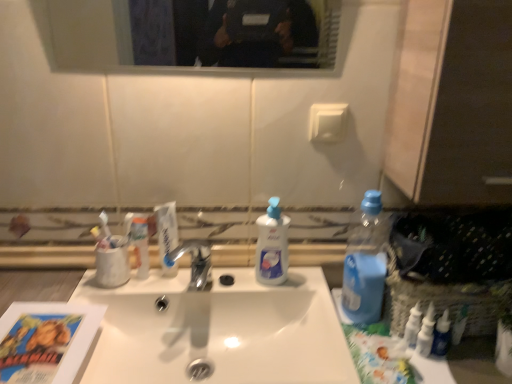
Question: Is white glossy sink at center bigger than white plastic bottles at right, the second toiletry in the left-to-right sequence?

Choices:
 (A) yes
 (B) no

Answer: (A)

Question: Does white glossy sink at center touch white plastic bottles at right, the 2th toiletry in the back-to-front sequence?

Choices:
 (A) no
 (B) yes

Answer: (A)

Question: From the image's perspective, is white glossy sink at center located above white plastic bottles at right, positioned as the 2th toiletry in right-to-left order?

Choices:
 (A) no
 (B) yes

Answer: (A)

Question: Does white glossy sink at center have a smaller size compared to white plastic bottles at right, the 2th toiletry in the back-to-front sequence?

Choices:
 (A) no
 (B) yes

Answer: (A)

Question: Is white plastic bottles at right, the 2th toiletry in the back-to-front sequence, completely or partially inside white glossy sink at center?

Choices:
 (A) yes
 (B) no

Answer: (B)

Question: Considering the relative positions of white glossy sink at center and white plastic bottles at right, which is the 2th toiletry in front-to-back order, in the image provided, is white glossy sink at center to the right of white plastic bottles at right, which is the 2th toiletry in front-to-back order, from the viewer's perspective?

Choices:
 (A) no
 (B) yes

Answer: (A)

Question: Can you see blue plastic bottle at right touching white plastic bottles at right, the second toiletry in the left-to-right sequence?

Choices:
 (A) yes
 (B) no

Answer: (B)

Question: Is the position of blue plastic bottle at right more distant than that of white plastic bottles at right, the 2th toiletry in the back-to-front sequence?

Choices:
 (A) no
 (B) yes

Answer: (A)

Question: Considering the relative positions of blue plastic bottle at right and white plastic bottles at right, the second toiletry in the left-to-right sequence, in the image provided, is blue plastic bottle at right to the right of white plastic bottles at right, the second toiletry in the left-to-right sequence, from the viewer's perspective?

Choices:
 (A) no
 (B) yes

Answer: (A)

Question: Is blue plastic bottle at right turned away from white plastic bottles at right, the 2th toiletry in the back-to-front sequence?

Choices:
 (A) yes
 (B) no

Answer: (B)

Question: Can you confirm if blue plastic bottle at right is smaller than white plastic bottles at right, positioned as the 2th toiletry in right-to-left order?

Choices:
 (A) no
 (B) yes

Answer: (A)

Question: Does blue plastic bottle at right contain white plastic bottles at right, positioned as the 2th toiletry in right-to-left order?

Choices:
 (A) yes
 (B) no

Answer: (B)

Question: Is blue glossy bottle at lower right, the third toiletry when ordered from left to right, not inside white glossy sink at center?

Choices:
 (A) no
 (B) yes

Answer: (B)